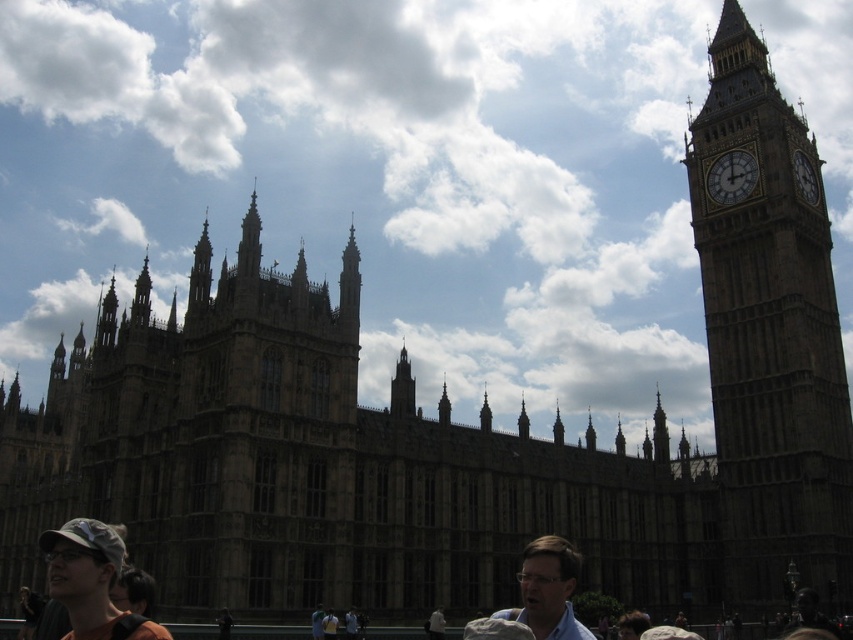
You are standing in front of the Elizabeth Tower and notice a blue fabric shirt at lower center and a white stone clock at upper right. Which object is taller?

The blue fabric shirt at lower center is much taller than the white stone clock at upper right.

You are standing at the tourist spot and see the brown stone clock tower at right and the camouflage fabric cap at lower left. Which object is taller?

The brown stone clock tower at right is taller than the camouflage fabric cap at lower left.